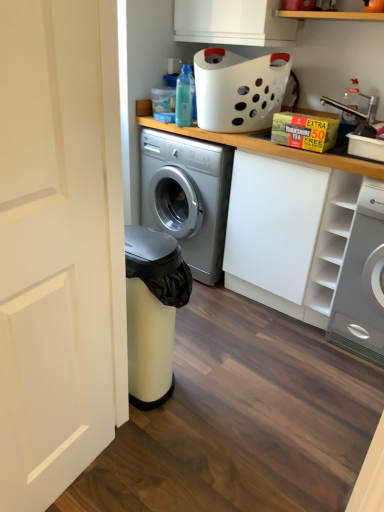
Question: Is white matte door at left wider or thinner than translucent plastic bottle at upper right?

Choices:
 (A) wide
 (B) thin

Answer: (B)

Question: Is white matte door at left situated inside translucent plastic bottle at upper right or outside?

Choices:
 (A) inside
 (B) outside

Answer: (B)

Question: Based on their relative distances, which object is nearer to the translucent plastic bottle at upper right?

Choices:
 (A) white plastic sink at upper right
 (B) translucent plastic bottle at upper center
 (C) white glossy washing machine at right
 (D) white matte cabinet at upper right
 (E) white matte cabinet at upper right

Answer: (A)

Question: Which object is the farthest from the white glossy washing machine at right?

Choices:
 (A) white matte cabinet at upper right
 (B) translucent plastic bottle at upper right
 (C) translucent plastic bottle at upper center
 (D) white matte door at left
 (E) white plastic sink at upper right

Answer: (D)